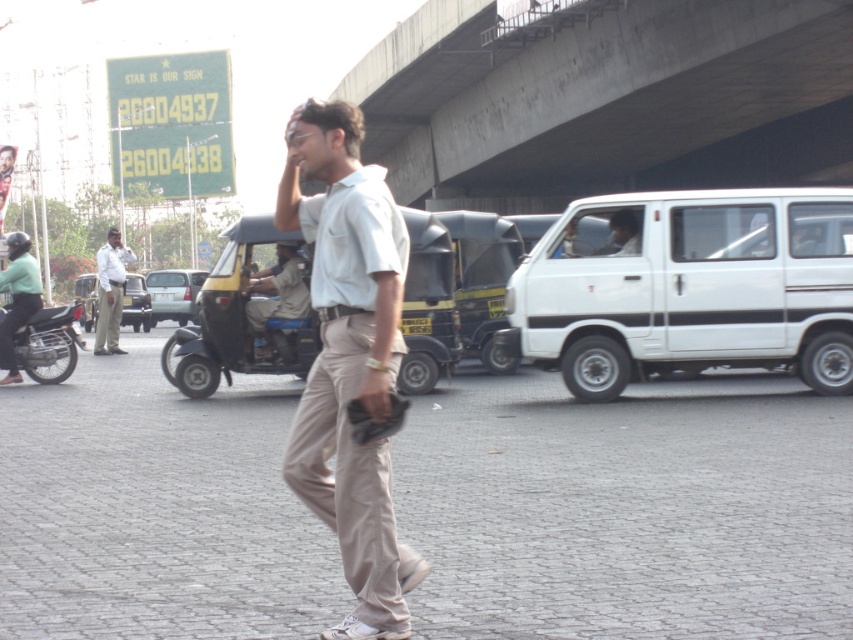
Based on the photo, does concrete at upper center have a smaller size compared to dark blue uniform at center?

Actually, concrete at upper center might be larger than dark blue uniform at center.

Does concrete at upper center appear over dark blue uniform at center?

Correct, concrete at upper center is located above dark blue uniform at center.

Which is behind, point (547, 106) or point (260, 316)?

The point (547, 106) is behind.

Find the location of a particular element. This screenshot has width=853, height=640. concrete at upper center is located at coordinates [606, 99].

Does white matte van at right have a larger size compared to black matte motorcycle at left?

Actually, white matte van at right might be smaller than black matte motorcycle at left.

Which is more to the right, white matte van at right or black matte motorcycle at left?

white matte van at right is more to the right.

Where is `white matte van at right`? white matte van at right is located at coordinates (689, 288).

Does white matte van at right appear over light beige cotton shirt at center?

Indeed, white matte van at right is positioned over light beige cotton shirt at center.

Can you confirm if white matte van at right is positioned to the left of light beige cotton shirt at center?

In fact, white matte van at right is to the right of light beige cotton shirt at center.

This screenshot has width=853, height=640. I want to click on white matte van at right, so click(689, 288).

Identify the location of white matte van at right. click(x=689, y=288).